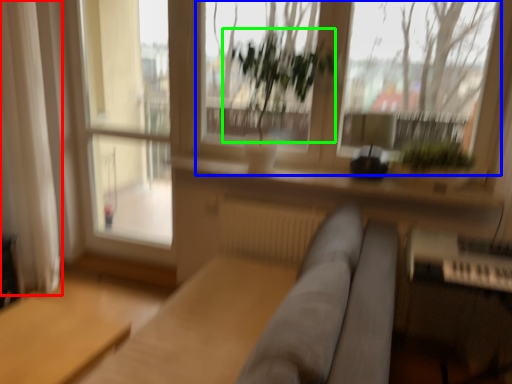
Question: Which object is the closest to the curtain (highlighted by a red box)? Choose among these: window screen (highlighted by a blue box) or vegetation (highlighted by a green box).

Choices:
 (A) window screen
 (B) vegetation

Answer: (B)